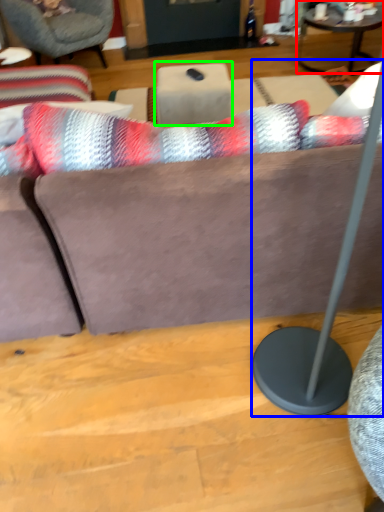
Question: Which object is positioned closest to coffee table (highlighted by a red box)? Select from table lamp (highlighted by a blue box) and table (highlighted by a green box).

Choices:
 (A) table lamp
 (B) table

Answer: (B)